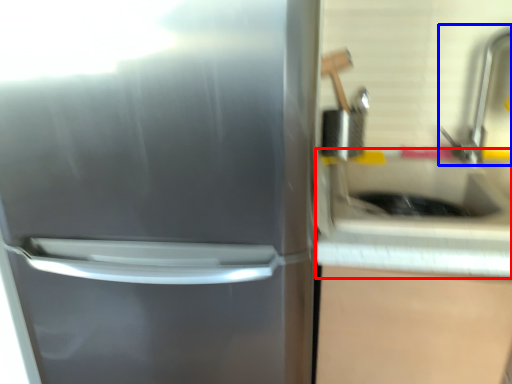
Question: Which object is closer to the camera taking this photo, counter top (highlighted by a red box) or faucet (highlighted by a blue box)?

Choices:
 (A) counter top
 (B) faucet

Answer: (A)